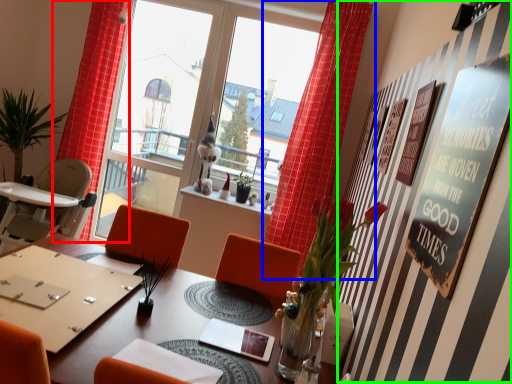
Question: Which object is positioned farthest from curtain (highlighted by a red box)? Select from curtain (highlighted by a blue box) and bulletin board (highlighted by a green box).

Choices:
 (A) curtain
 (B) bulletin board

Answer: (B)